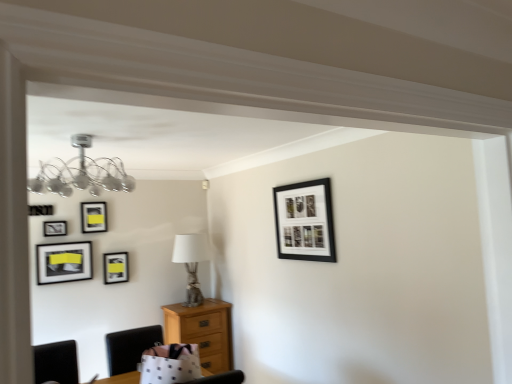
Question: Is light brown wooden chest of drawers at lower left bigger or smaller than matte black picture frame at upper left, which ranks as the 2th picture frame in back-to-front order?

Choices:
 (A) big
 (B) small

Answer: (A)

Question: Is light brown wooden chest of drawers at lower left to the left or to the right of matte black picture frame at upper left, which ranks as the 2th picture frame in back-to-front order, in the image?

Choices:
 (A) left
 (B) right

Answer: (B)

Question: Estimate the real-world distances between objects in this image. Which object is farther from the white fabric lampshade at center?

Choices:
 (A) light brown wooden chest of drawers at lower left
 (B) matte black picture frame at upper left, the 4th picture frame positioned from the left
 (C) matte black picture frame at upper left, marked as the fifth picture frame in a right-to-left arrangement
 (D) black leather chair at lower left
 (E) chrome metallic chandelier at upper left

Answer: (E)

Question: Which object is the farthest from the matte black picture frame at upper right, the first picture frame viewed from the front?

Choices:
 (A) chrome metallic chandelier at upper left
 (B) white fabric lampshade at center
 (C) black leather chair at lower left
 (D) light brown wooden chest of drawers at lower left
 (E) matte black picture frame at upper left, which is the 3th picture frame in left-to-right order

Answer: (E)